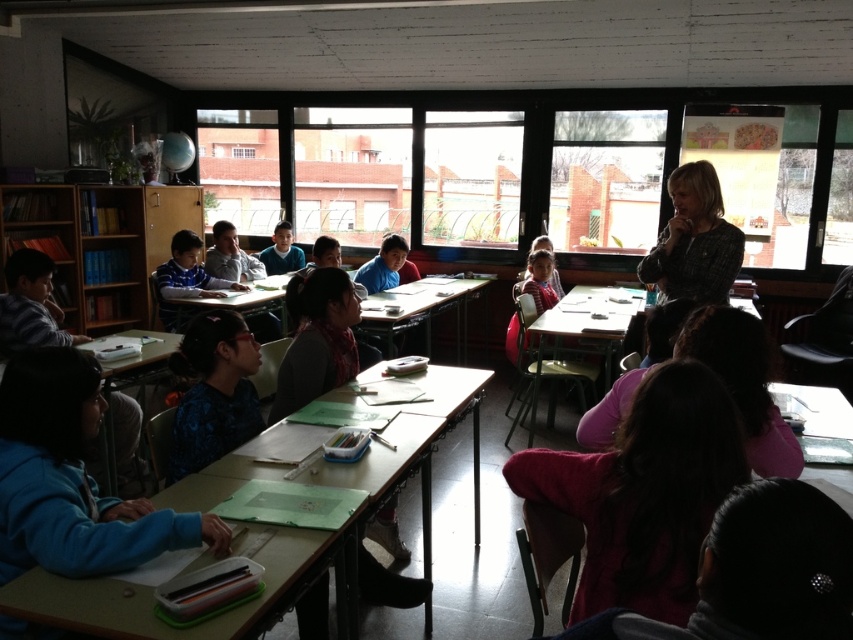
Question: Which of the following is the farthest from the observer?

Choices:
 (A) wooden desk at lower left
 (B) wooden bookshelf at left
 (C) wooden desk at center
 (D) plaid fabric teacher at upper right

Answer: (B)

Question: Among these objects, which one is farthest from the camera?

Choices:
 (A) wooden desk at lower left
 (B) plaid fabric teacher at upper right

Answer: (B)

Question: Can you confirm if wooden desk at lower left is wider than wooden desk at center?

Choices:
 (A) no
 (B) yes

Answer: (B)

Question: Which point appears closest to the camera in this image?

Choices:
 (A) (637, 273)
 (B) (44, 620)

Answer: (B)

Question: Is wooden desk at lower left in front of plaid fabric teacher at upper right?

Choices:
 (A) yes
 (B) no

Answer: (A)

Question: From the image, what is the correct spatial relationship of wooden desk at lower left in relation to wooden desk at center?

Choices:
 (A) left
 (B) right

Answer: (A)